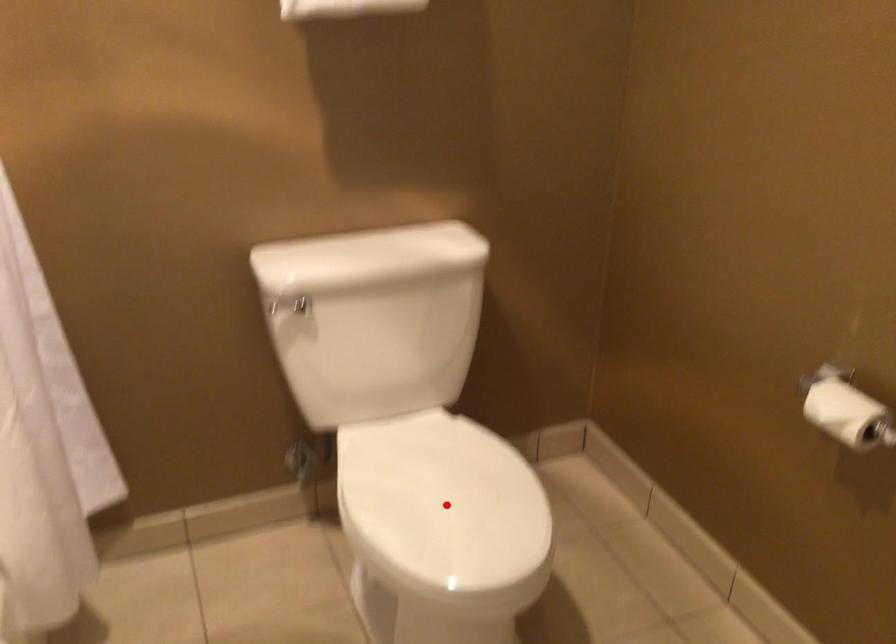
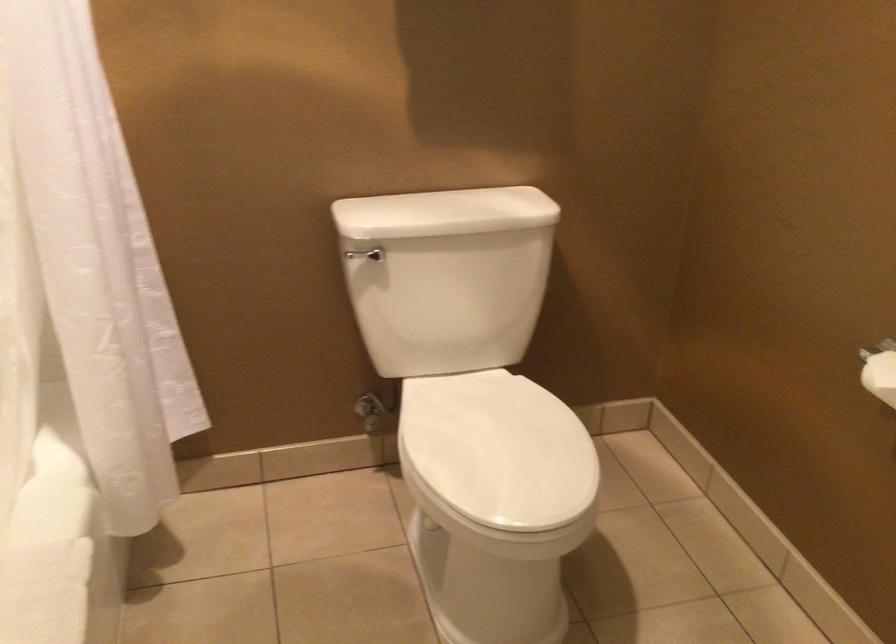
In the second image, find the point that corresponds to the highlighted location in the first image.

(498, 450)